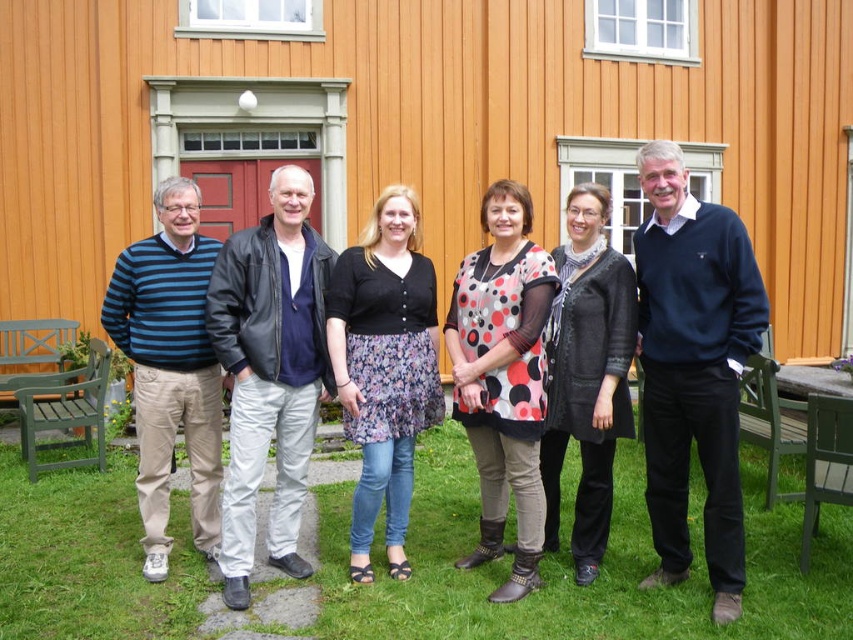
Question: Can you confirm if dark blue sweater at center is positioned below black textured cardigan at center?

Choices:
 (A) no
 (B) yes

Answer: (A)

Question: Does floral-patterned skirt at center have a larger size compared to blue striped sweater at left?

Choices:
 (A) no
 (B) yes

Answer: (A)

Question: Which of these objects is positioned farthest from the matte black sweater at center?

Choices:
 (A) black textured cardigan at center
 (B) dark blue sweater at center
 (C) blue striped sweater at left

Answer: (C)

Question: Which point is closer to the camera?

Choices:
 (A) polka dot fabric dress at center
 (B) blue striped sweater at left
 (C) dark blue sweater at center
 (D) matte black sweater at center

Answer: (C)

Question: Is matte black sweater at center thinner than floral-patterned skirt at center?

Choices:
 (A) yes
 (B) no

Answer: (B)

Question: Based on their relative distances, which object is farther from the dark blue sweater at center?

Choices:
 (A) polka dot fabric dress at center
 (B) floral-patterned skirt at center
 (C) matte black sweater at center
 (D) blue striped sweater at left

Answer: (D)